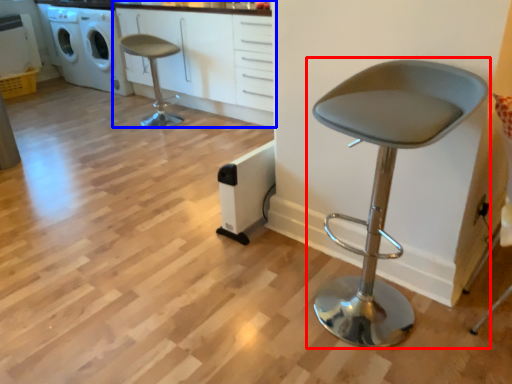
Question: Among these objects, which one is farthest to the camera, chair (highlighted by a red box) or cabinetry (highlighted by a blue box)?

Choices:
 (A) chair
 (B) cabinetry

Answer: (B)